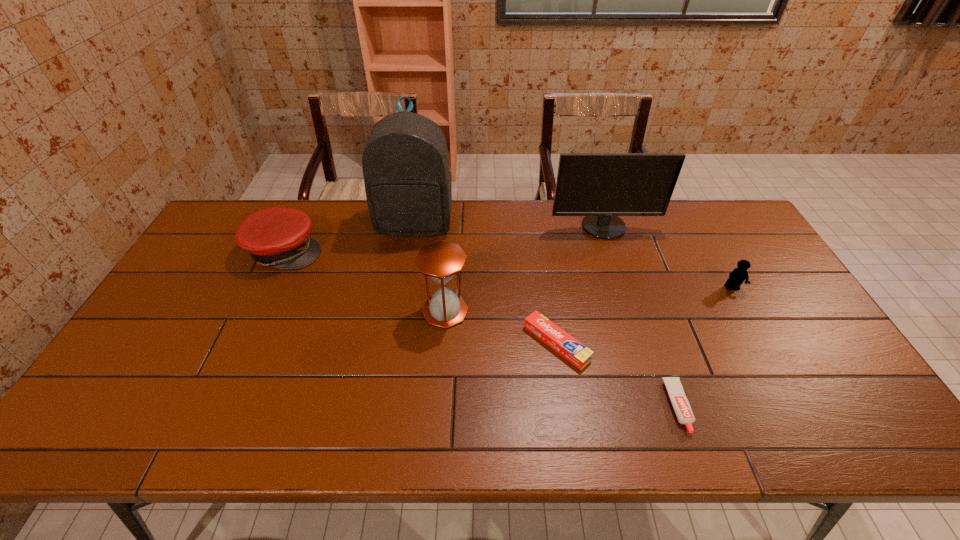
Find the location of a particular element. The image size is (960, 540). free space that is in between the left toothpaste and the leftmost object is located at coordinates (420, 297).

Image resolution: width=960 pixels, height=540 pixels. Identify the location of vacant space that's between the fourth nearest object and the tallest object. (573, 256).

The width and height of the screenshot is (960, 540). I want to click on vacant region between the nearest object and the leftmost object, so coord(482,328).

This screenshot has height=540, width=960. What are the coordinates of `free space between the fourth farthest object and the farther toothpaste` in the screenshot? It's located at (644, 315).

In order to click on vacant space that's between the fourth nearest object and the nearest object in this screenshot , I will do `click(705, 347)`.

The width and height of the screenshot is (960, 540). I want to click on empty space between the Lego and the leftmost object, so click(x=509, y=269).

Where is `free spot between the backpack and the cap`? free spot between the backpack and the cap is located at coordinates (350, 237).

Where is `object that is the second closest to the right toothpaste`? object that is the second closest to the right toothpaste is located at coordinates coord(738,275).

This screenshot has width=960, height=540. I want to click on the fifth closest object to the rightmost object, so click(x=406, y=170).

Locate an element on the screen. vacant space that satisfies the following two spatial constraints: 1. on the screen side of the monitor; 2. on the front of the cap with an emblem is located at coordinates (612, 251).